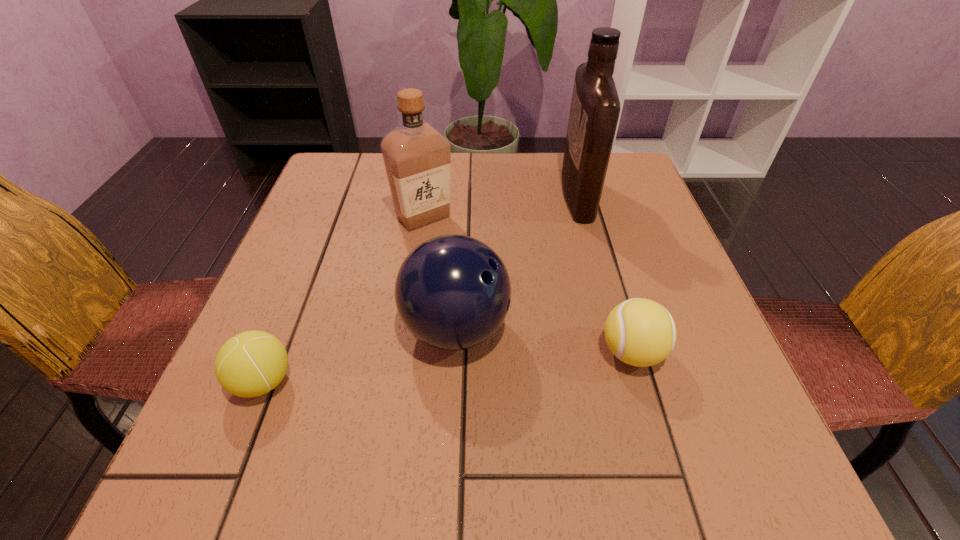
The width and height of the screenshot is (960, 540). Find the location of `blank space at the left edge`. blank space at the left edge is located at coordinates click(273, 410).

Identify the location of free space at the right edge of the desktop. This screenshot has width=960, height=540. (630, 228).

You are a GUI agent. You are given a task and a screenshot of the screen. Output one action in this format:
    pyautogui.click(x=<x>, y=<y>)
    Task: Click on the free space at the far left corner of the desktop
    
    Given the screenshot: What is the action you would take?
    pyautogui.click(x=317, y=203)

What are the coordinates of `free region at the near right corner` in the screenshot? It's located at (756, 463).

I want to click on vacant area between the right tennis ball and the second tallest object, so click(527, 285).

Locate an element on the screen. free space between the right tennis ball and the bowling ball is located at coordinates 543,340.

At what (x,y) coordinates should I click in order to perform the action: click on free point between the third tallest object and the right tennis ball. Please return your answer as a coordinate pair (x, y). The image size is (960, 540). Looking at the image, I should click on (543, 340).

Identify the location of free space between the right liquor and the third tallest object. The width and height of the screenshot is (960, 540). (516, 262).

Where is `blank region between the leftmost object and the third tallest object`? This screenshot has width=960, height=540. blank region between the leftmost object and the third tallest object is located at coordinates (359, 355).

Locate an element on the screen. This screenshot has height=540, width=960. free spot between the right liquor and the bowling ball is located at coordinates (516, 262).